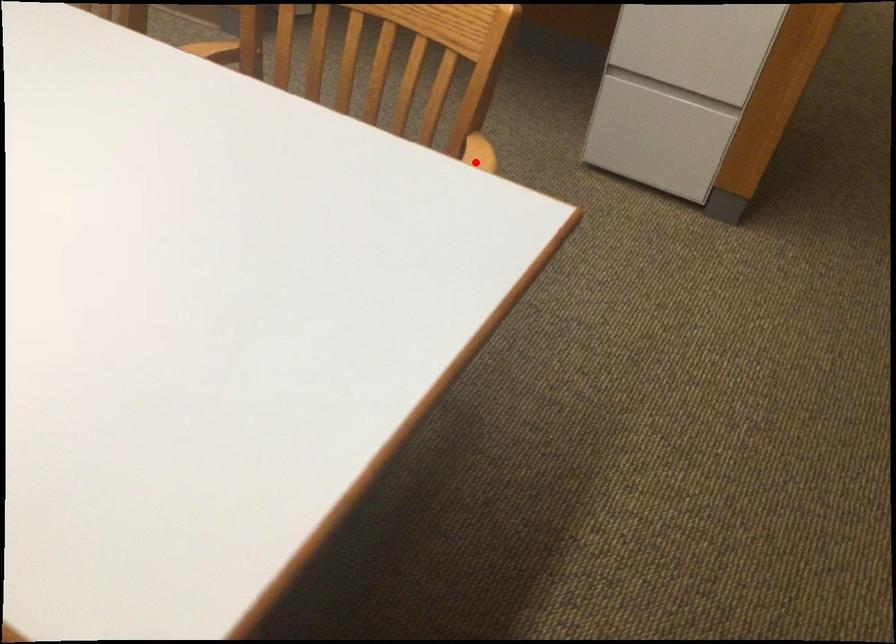
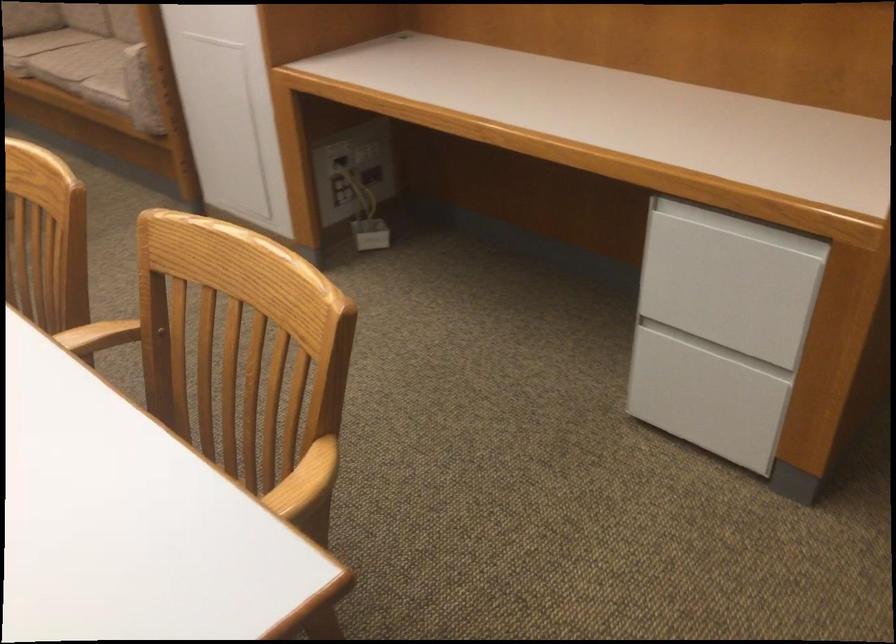
In the second image, find the point that corresponds to the highlighted location in the first image.

(304, 482)